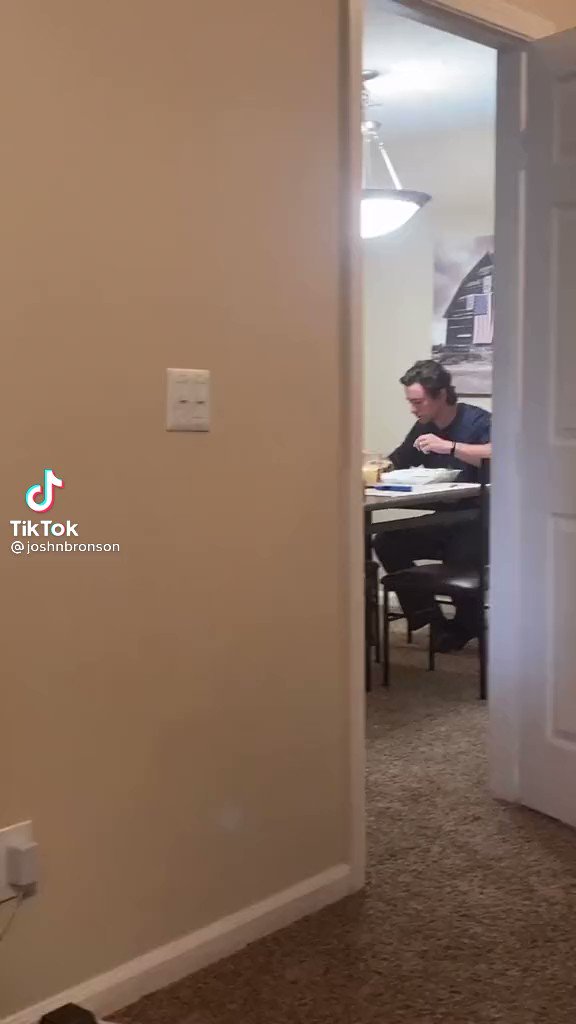
This screenshot has width=576, height=1024. I want to click on floor, so click(x=473, y=867).